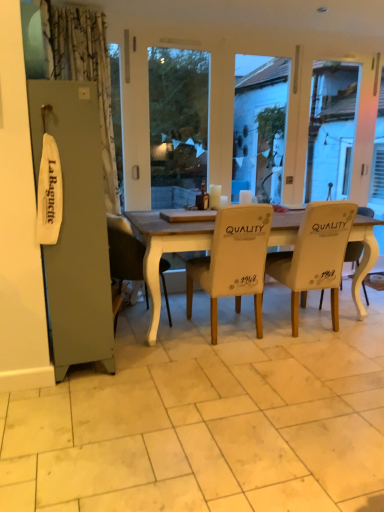
Where is `vacant area that is in front of white leather chair at center, the 3th chair viewed from the right`? vacant area that is in front of white leather chair at center, the 3th chair viewed from the right is located at coordinates (231, 366).